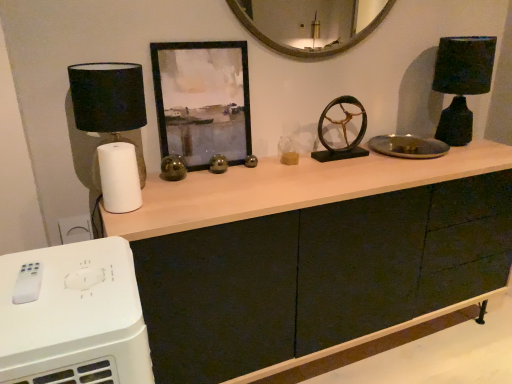
In order to click on matte black cabinet at center in this screenshot , I will do `click(284, 257)`.

Where is `bronze metallic wheel at center`? The height and width of the screenshot is (384, 512). bronze metallic wheel at center is located at coordinates (343, 122).

The image size is (512, 384). In order to click on black matte picture frame at center in this screenshot , I will do `click(202, 100)`.

From a real-world perspective, is black matte picture frame at center below matte black lampshade at left, which appears as the 1th table lamp when viewed from the front?

No, from a real-world perspective, black matte picture frame at center is not below matte black lampshade at left, which appears as the 1th table lamp when viewed from the front.

From the image's perspective, is black matte picture frame at center located above matte black lampshade at left, positioned as the 2th table lamp in right-to-left order?

Yes, from the image's perspective, black matte picture frame at center is on top of matte black lampshade at left, positioned as the 2th table lamp in right-to-left order.

The width and height of the screenshot is (512, 384). Find the location of `table lamp below the black matte picture frame at center (from the image's perspective)`. table lamp below the black matte picture frame at center (from the image's perspective) is located at coordinates (112, 126).

You are a GUI agent. You are given a task and a screenshot of the screen. Output one action in this format:
    pyautogui.click(x=<x>, y=<y>)
    Task: Click on the 2nd table lamp above the bronze metallic wheel at center (from a real-world perspective)
    Image resolution: width=512 pixels, height=384 pixels.
    Given the screenshot: What is the action you would take?
    pyautogui.click(x=461, y=82)

Which of these two, bronze metallic wheel at center or matte black lampshade at right, positioned as the 1th table lamp in right-to-left order, is wider?

With larger width is matte black lampshade at right, positioned as the 1th table lamp in right-to-left order.

What's the angular difference between bronze metallic wheel at center and matte black lampshade at right, the 1th table lamp when ordered from back to front,'s facing directions?

There is a 0.00134-degree angle between the facing directions of bronze metallic wheel at center and matte black lampshade at right, the 1th table lamp when ordered from back to front.

Which is in front, point (340, 122) or point (454, 48)?

The point (454, 48) is more forward.

You are a GUI agent. You are given a task and a screenshot of the screen. Output one action in this format:
    pyautogui.click(x=<x>, y=<y>)
    Task: Click on the table lamp above the black matte picture frame at center (from a real-world perspective)
    
    Given the screenshot: What is the action you would take?
    pyautogui.click(x=461, y=82)

Which of these two, black matte picture frame at center or matte black lampshade at right, which is the second table lamp from front to back, stands taller?

With more height is black matte picture frame at center.

Measure the distance from black matte picture frame at center to matte black lampshade at right, which is the second table lamp from front to back.

36.15 inches.

From a real-world perspective, is black matte picture frame at center below matte black lampshade at right, positioned as the 1th table lamp in right-to-left order?

Yes.

In the scene shown: From a real-world perspective, relative to bronze metallic wheel at center, is matte black lampshade at right, arranged as the 2th table lamp when viewed from the left, vertically above or below?

matte black lampshade at right, arranged as the 2th table lamp when viewed from the left, is above bronze metallic wheel at center.

Does matte black lampshade at right, positioned as the 1th table lamp in right-to-left order, have a greater height compared to bronze metallic wheel at center?

Correct, matte black lampshade at right, positioned as the 1th table lamp in right-to-left order, is much taller as bronze metallic wheel at center.

In the scene shown: Is bronze metallic wheel at center inside matte black lampshade at right, which is the second table lamp from front to back?

No, bronze metallic wheel at center is not inside matte black lampshade at right, which is the second table lamp from front to back.

How different are the orientations of matte black lampshade at right, positioned as the 1th table lamp in right-to-left order, and bronze metallic wheel at center in degrees?

The angle between the facing direction of matte black lampshade at right, positioned as the 1th table lamp in right-to-left order, and the facing direction of bronze metallic wheel at center is 0.00134 degrees.

Between matte black cabinet at center and matte black lampshade at left, positioned as the 2th table lamp in right-to-left order, which one has larger size?

matte black cabinet at center.

This screenshot has width=512, height=384. Identify the location of cabinetry that appears on the right of matte black lampshade at left, positioned as the 2th table lamp in right-to-left order. (284, 257).

Between matte black cabinet at center and matte black lampshade at left, which is counted as the 1th table lamp, starting from the left, which one appears on the right side from the viewer's perspective?

From the viewer's perspective, matte black cabinet at center appears more on the right side.

What's the angular difference between matte black cabinet at center and matte black lampshade at left, which is counted as the 1th table lamp, starting from the left,'s facing directions?

The angle between the facing direction of matte black cabinet at center and the facing direction of matte black lampshade at left, which is counted as the 1th table lamp, starting from the left, is 0.195 degrees.

Based on the photo, is bronze metallic wheel at center in contact with black matte picture frame at center?

They are not placed beside each other.

From the image's perspective, who appears lower, bronze metallic wheel at center or black matte picture frame at center?

From the image's view, bronze metallic wheel at center is below.

Which is in front, point (318, 133) or point (182, 120)?

The point (182, 120) is closer.

Considering the relative positions of bronze metallic wheel at center and black matte picture frame at center in the image provided, is bronze metallic wheel at center behind black matte picture frame at center?

Yes, bronze metallic wheel at center is behind black matte picture frame at center.

Does white plastic remote control at lower left have a greater width compared to bronze metallic wheel at center?

Indeed, white plastic remote control at lower left has a greater width compared to bronze metallic wheel at center.

From a real-world perspective, is white plastic remote control at lower left located beneath bronze metallic wheel at center?

Answer: Yes, from a real-world perspective, white plastic remote control at lower left is below bronze metallic wheel at center.

Looking at this image, from the image's perspective, is white plastic remote control at lower left located beneath bronze metallic wheel at center?

Yes, from the image's perspective, white plastic remote control at lower left is beneath bronze metallic wheel at center.

How far apart are white plastic remote control at lower left and bronze metallic wheel at center?

white plastic remote control at lower left and bronze metallic wheel at center are 1.17 meters apart.

At what (x,y) coordinates should I click in order to perform the action: click on picture frame positioned vertically above the matte black lampshade at left, positioned as the 2th table lamp in right-to-left order (from a real-world perspective). Please return your answer as a coordinate pair (x, y). This screenshot has height=384, width=512. Looking at the image, I should click on (202, 100).

You are a GUI agent. You are given a task and a screenshot of the screen. Output one action in this format:
    pyautogui.click(x=<x>, y=<y>)
    Task: Click on the table lamp on the right of bronze metallic wheel at center
    
    Given the screenshot: What is the action you would take?
    pyautogui.click(x=461, y=82)

From the image, which object appears to be nearer to white plastic remote control at lower left, matte black lampshade at right, arranged as the 2th table lamp when viewed from the left, or matte black cabinet at center?

Among the two, matte black cabinet at center is located nearer to white plastic remote control at lower left.

When comparing their distances from matte black lampshade at right, positioned as the 1th table lamp in right-to-left order, does white plastic remote control at lower left or black matte picture frame at center seem further?

Based on the image, white plastic remote control at lower left appears to be further to matte black lampshade at right, positioned as the 1th table lamp in right-to-left order.

From the image, which object appears to be farther from black matte picture frame at center, matte black lampshade at right, arranged as the 2th table lamp when viewed from the left, or bronze metallic wheel at center?

Among the two, matte black lampshade at right, arranged as the 2th table lamp when viewed from the left, is located further to black matte picture frame at center.

Looking at this image, considering their positions, is black matte picture frame at center positioned closer to matte black lampshade at right, which is the second table lamp from front to back, than bronze metallic wheel at center?

bronze metallic wheel at center lies closer to matte black lampshade at right, which is the second table lamp from front to back, than the other object.

From the image, which object appears to be nearer to bronze metallic wheel at center, matte black lampshade at left, which is counted as the 1th table lamp, starting from the left, or matte black lampshade at right, arranged as the 2th table lamp when viewed from the left?

Among the two, matte black lampshade at right, arranged as the 2th table lamp when viewed from the left, is located nearer to bronze metallic wheel at center.

Considering their positions, is matte black lampshade at right, positioned as the 1th table lamp in right-to-left order, positioned further to white plastic remote control at lower left than black matte picture frame at center?

Based on the image, matte black lampshade at right, positioned as the 1th table lamp in right-to-left order, appears to be further to white plastic remote control at lower left.

From the image, which object appears to be farther from matte black lampshade at left, which is counted as the 1th table lamp, starting from the left, matte black lampshade at right, which is the second table lamp from front to back, or black matte picture frame at center?

matte black lampshade at right, which is the second table lamp from front to back, is further to matte black lampshade at left, which is counted as the 1th table lamp, starting from the left.

Considering their positions, is bronze metallic wheel at center positioned further to matte black lampshade at right, positioned as the 1th table lamp in right-to-left order, than matte black lampshade at left, which appears as the 1th table lamp when viewed from the front?

Among the two, matte black lampshade at left, which appears as the 1th table lamp when viewed from the front, is located further to matte black lampshade at right, positioned as the 1th table lamp in right-to-left order.

Where is `table lamp between white plastic remote control at lower left and bronze metallic wheel at center along the z-axis`? The width and height of the screenshot is (512, 384). table lamp between white plastic remote control at lower left and bronze metallic wheel at center along the z-axis is located at coordinates (112, 126).

Find the location of a particular element. The width and height of the screenshot is (512, 384). cabinetry situated between black matte picture frame at center and matte black lampshade at right, positioned as the 1th table lamp in right-to-left order, from left to right is located at coordinates (284, 257).

You are a GUI agent. You are given a task and a screenshot of the screen. Output one action in this format:
    pyautogui.click(x=<x>, y=<y>)
    Task: Click on the home appliance between matte black lampshade at left, positioned as the 2th table lamp in right-to-left order, and matte black cabinet at center
    This screenshot has width=512, height=384.
    Given the screenshot: What is the action you would take?
    pyautogui.click(x=73, y=316)

The height and width of the screenshot is (384, 512). Identify the location of picture frame between white plastic remote control at lower left and matte black lampshade at right, arranged as the 2th table lamp when viewed from the left. [x=202, y=100].